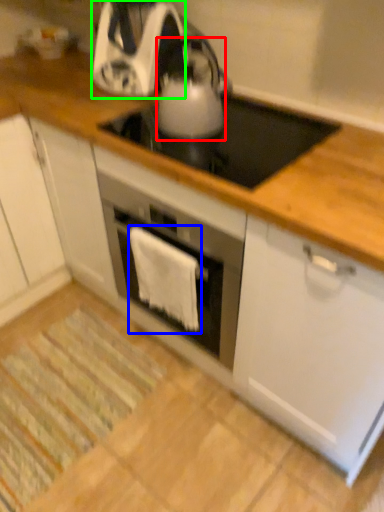
Question: Considering the real-world distances, which object is farthest from kitchen appliance (highlighted by a red box)? cloth (highlighted by a blue box) or kitchen appliance (highlighted by a green box)?

Choices:
 (A) cloth
 (B) kitchen appliance

Answer: (A)